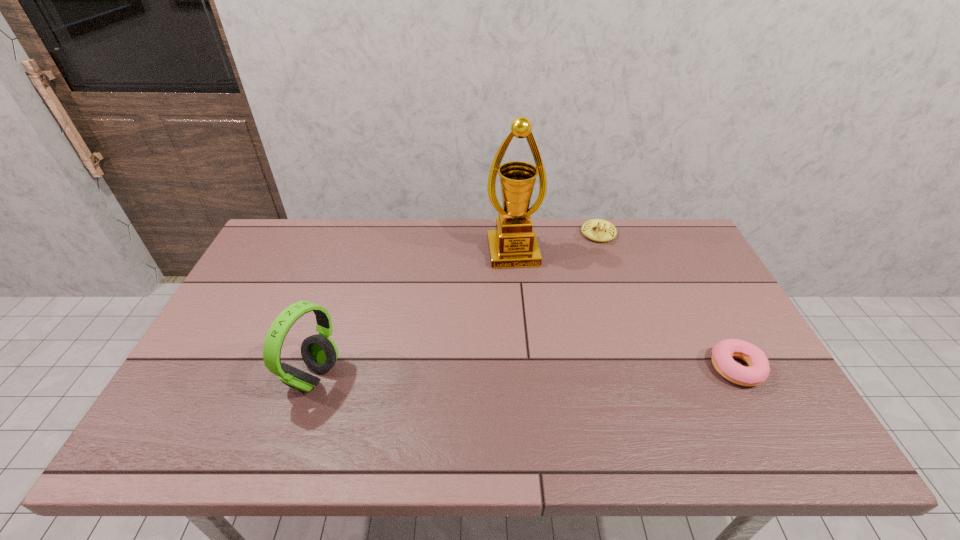
This screenshot has width=960, height=540. I want to click on blank region between the tallest object and the duckling, so click(x=556, y=244).

Locate an element on the screen. The image size is (960, 540). free space between the third object from left to right and the headset is located at coordinates (456, 305).

This screenshot has width=960, height=540. I want to click on empty space that is in between the leftmost object and the second object from right to left, so click(x=456, y=305).

Where is `free area in between the third object from right to left and the headset`? The width and height of the screenshot is (960, 540). free area in between the third object from right to left and the headset is located at coordinates (414, 314).

You are a GUI agent. You are given a task and a screenshot of the screen. Output one action in this format:
    pyautogui.click(x=<x>, y=<y>)
    Task: Click on the free point between the third object from right to left and the leftmost object
    
    Given the screenshot: What is the action you would take?
    pyautogui.click(x=414, y=314)

Where is `free space between the third object from right to left and the leftmost object`? This screenshot has width=960, height=540. free space between the third object from right to left and the leftmost object is located at coordinates (414, 314).

Locate an element on the screen. The width and height of the screenshot is (960, 540). free space between the shortest object and the second shortest object is located at coordinates (668, 301).

Find the location of `free spot between the tallest object and the third tallest object`. free spot between the tallest object and the third tallest object is located at coordinates (556, 244).

Find the location of a particular element. The width and height of the screenshot is (960, 540). free space between the leftmost object and the award is located at coordinates (414, 314).

Identify which object is the closest to the second object from left to right. Please provide its 2D coordinates. Your answer should be formatted as a tuple, i.e. [(x, y)], where the tuple contains the x and y coordinates of a point satisfying the conditions above.

[(600, 235)]